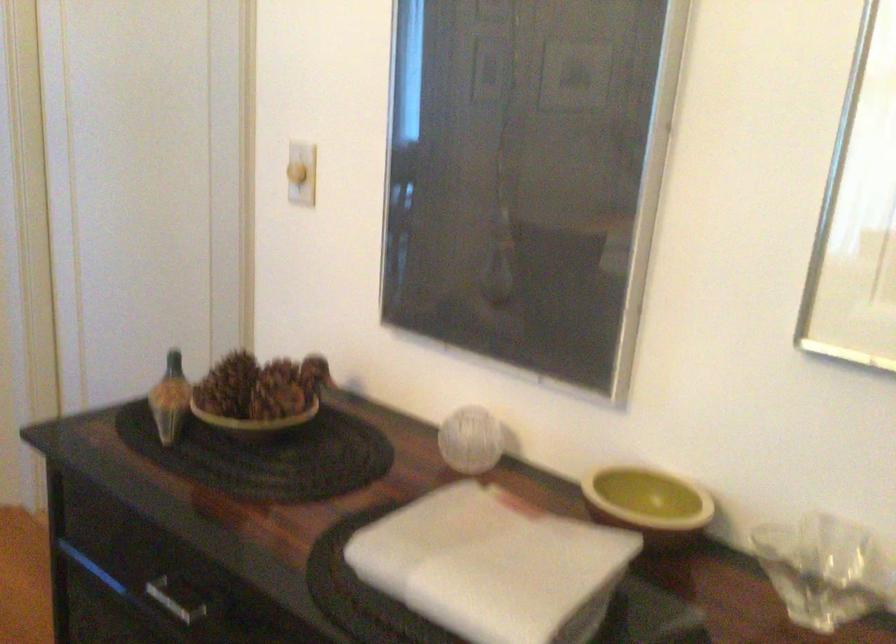
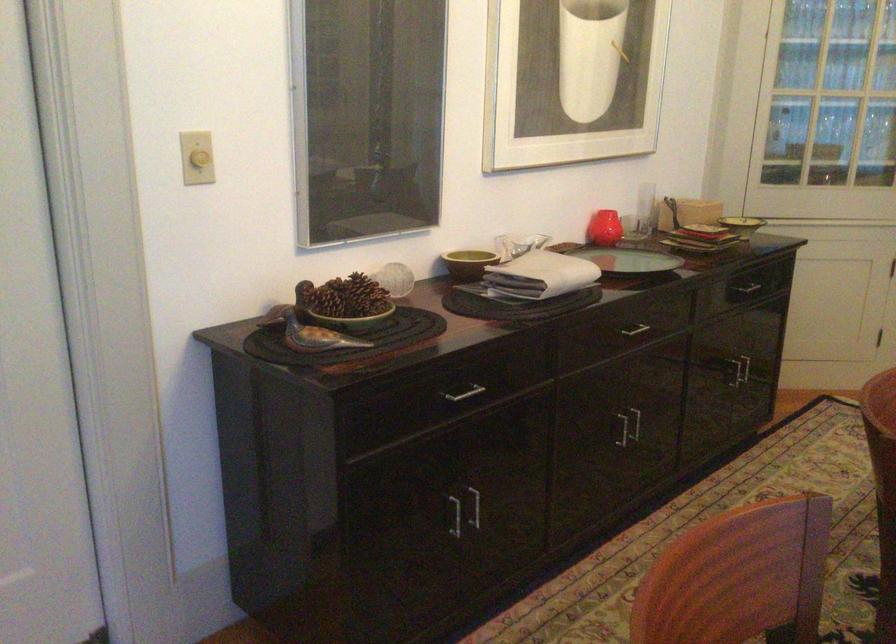
Locate, in the second image, the point that corresponds to point (600, 460) in the first image.

(468, 263)